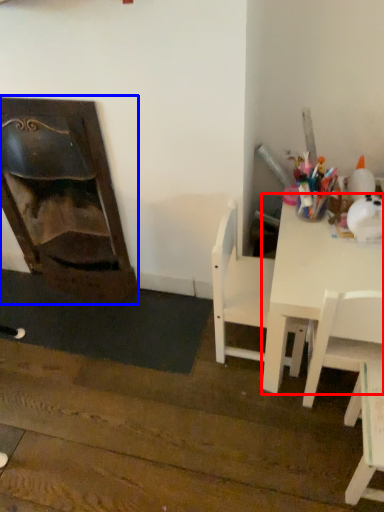
Question: Which point is further to the camera, table (highlighted by a red box) or fireplace (highlighted by a blue box)?

Choices:
 (A) table
 (B) fireplace

Answer: (B)